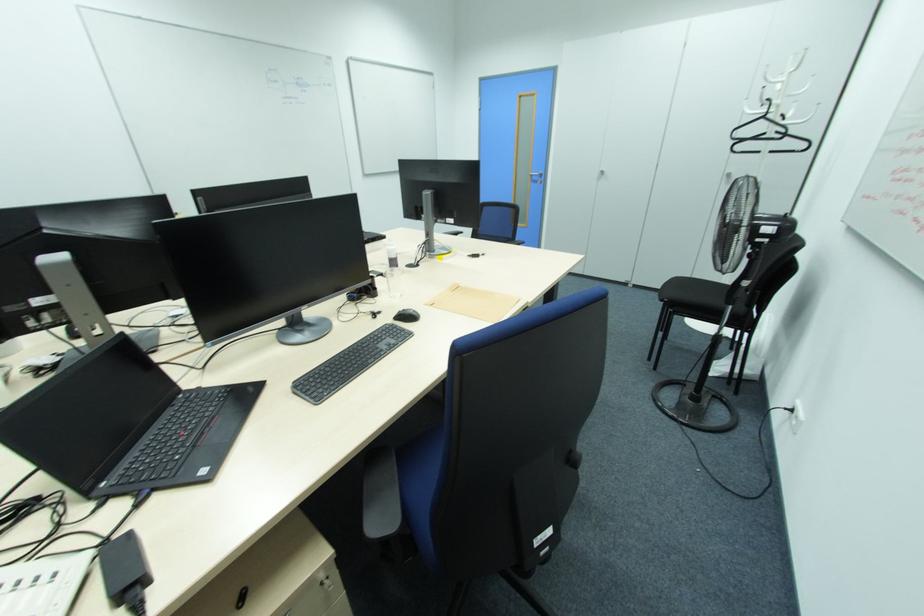
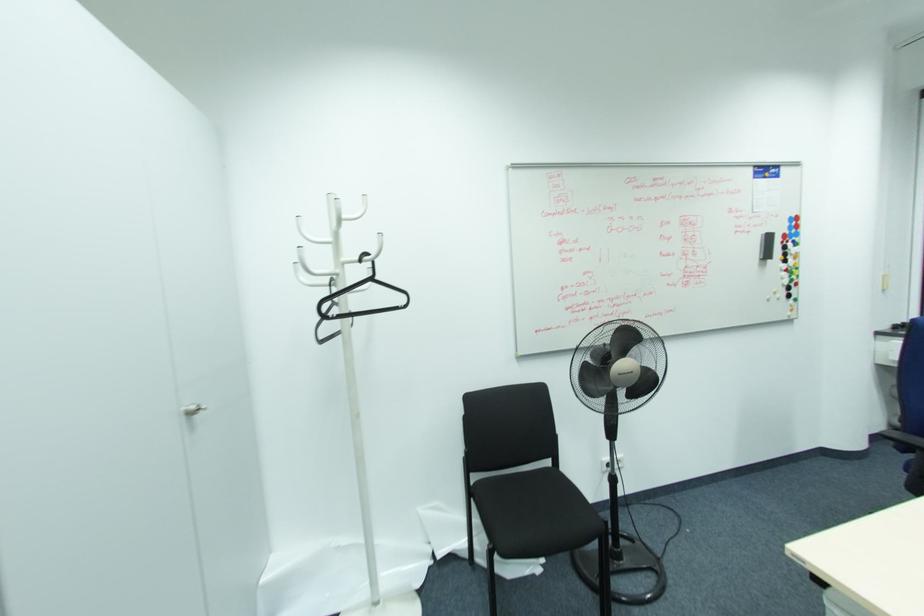
Locate, in the second image, the point that corresponds to (x=764, y=118) in the first image.

(371, 280)